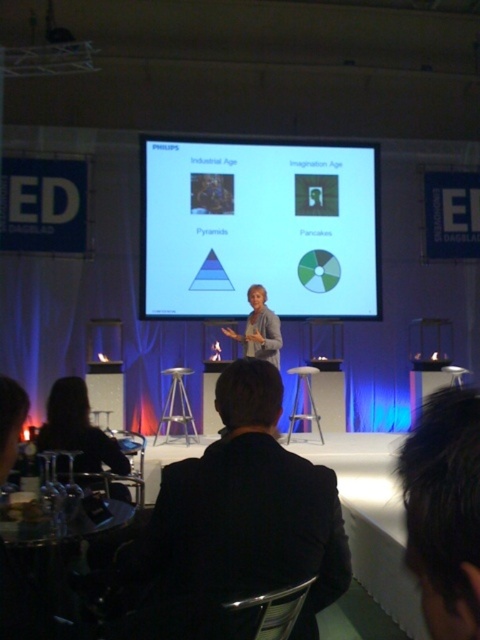
Question: Which is farther from the silver metallic stool at center?

Choices:
 (A) white glossy projection screen at center
 (B) silhouette hair at lower left
 (C) metallic stool at center
 (D) black suit at center

Answer: (D)

Question: Is black suit at center thinner than silhouette hair at lower left?

Choices:
 (A) no
 (B) yes

Answer: (A)

Question: Is silhouette hair at lower left bigger than silver metallic stool at center?

Choices:
 (A) yes
 (B) no

Answer: (B)

Question: Can you confirm if black suit at center is positioned below silhouette hair at lower left?

Choices:
 (A) no
 (B) yes

Answer: (A)

Question: Estimate the real-world distances between objects in this image. Which object is farther from the black suit at center?

Choices:
 (A) silhouette hair at lower left
 (B) white glossy projection screen at center
 (C) light beige blazer at center

Answer: (B)

Question: Which point appears farthest from the camera in this image?

Choices:
 (A) (121, 486)
 (B) (171, 380)
 (C) (288, 436)

Answer: (B)